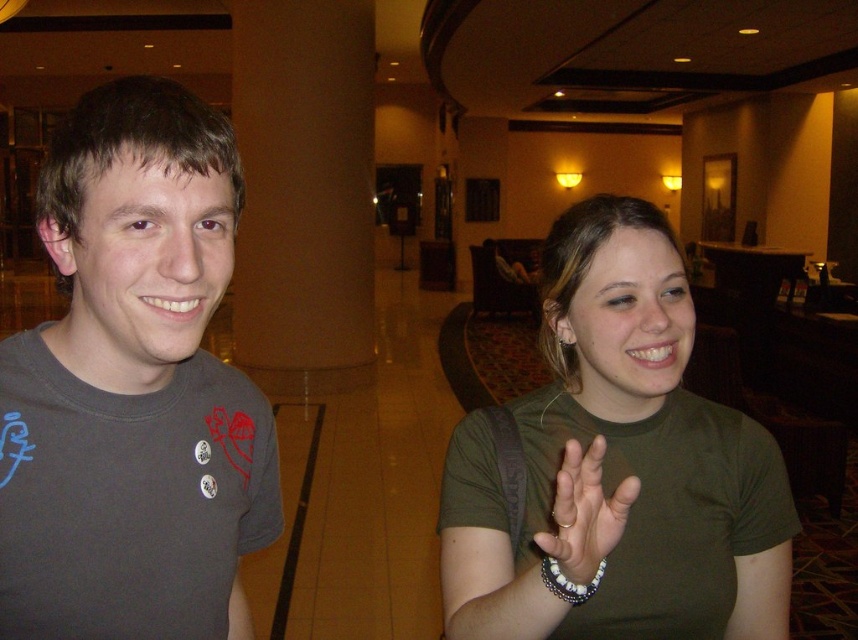
You are a photographer trying to capture a photo of the two people in the scene. You notice two points marked in the image. The first point is at coordinates point (728,436) and the second point is at point (551,532). Which point is closer to the camera?

Point (728,436) is further to the camera than point (551,532). Therefore, point (551,532) is closer to the camera.

Based on the photo, you are a photographer trying to capture a clear shot of both the green matte shirt at center and the white beaded bracelet at lower right. Since you want both subjects in focus, which one should you adjust your camera focus on first?

The green matte shirt at center is closer to the viewer than the white beaded bracelet at lower right. To ensure both are in focus, you should focus on the green matte shirt at center first, as it is closer, and the depth of field will naturally include the bracelet if focused properly.